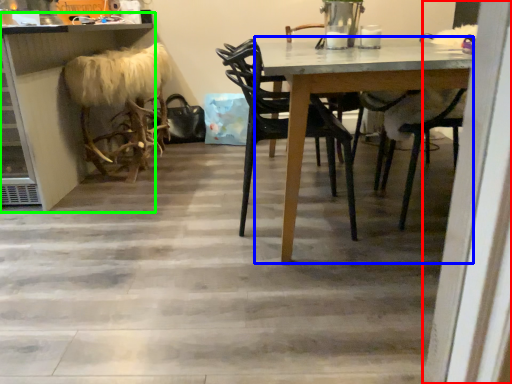
Question: Estimate the real-world distances between objects in this image. Which object is closer to screen door (highlighted by a red box), table (highlighted by a blue box) or counter (highlighted by a green box)?

Choices:
 (A) table
 (B) counter

Answer: (A)